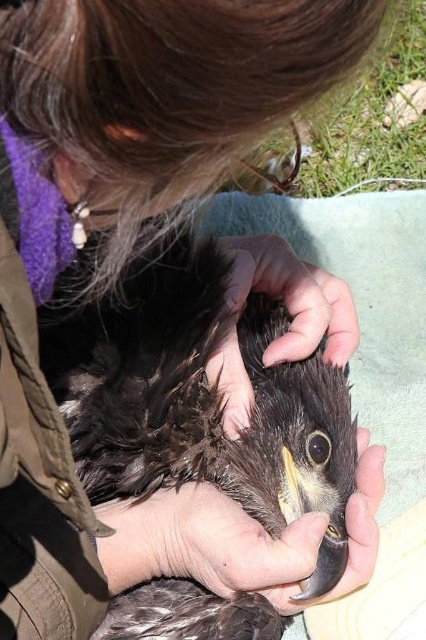
Is dark brown feathers at center shorter than brown feathered hand at center?

No.

Is dark brown feathers at center positioned at the back of brown feathered hand at center?

That is False.

What do you see at coordinates (189, 387) in the screenshot? The image size is (426, 640). I see `dark brown feathers at center` at bounding box center [189, 387].

Locate an element on the screen. The image size is (426, 640). dark brown feathers at center is located at coordinates (189, 387).